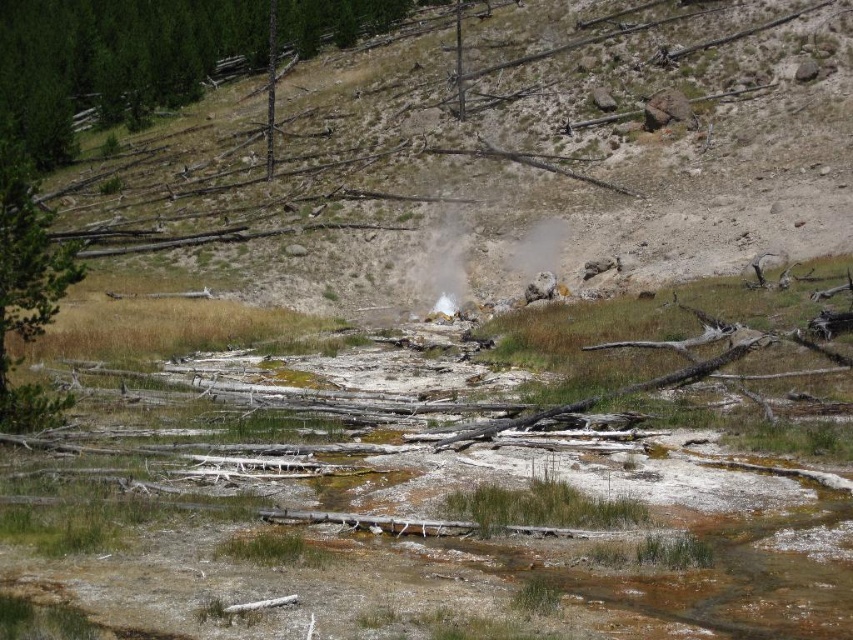
Question: Can you confirm if dull yellowish rock at center is positioned to the right of brown wood tree at upper left?

Choices:
 (A) yes
 (B) no

Answer: (A)

Question: Observing the image, what is the correct spatial positioning of green rough bark tree at left in reference to white vapor at center?

Choices:
 (A) above
 (B) below

Answer: (A)

Question: Which of the following is the farthest from the observer?

Choices:
 (A) (36, 273)
 (B) (80, 17)
 (C) (521, 241)

Answer: (B)

Question: Is the position of brown wood tree at upper left more distant than that of white vapor at center?

Choices:
 (A) no
 (B) yes

Answer: (B)

Question: Which object is the closest to the dull yellowish rock at center?

Choices:
 (A) white vapor at center
 (B) green rough bark tree at left
 (C) brown wood tree at upper left

Answer: (C)

Question: Which object is the farthest from the white vapor at center?

Choices:
 (A) green rough bark tree at left
 (B) brown wood tree at upper left

Answer: (B)